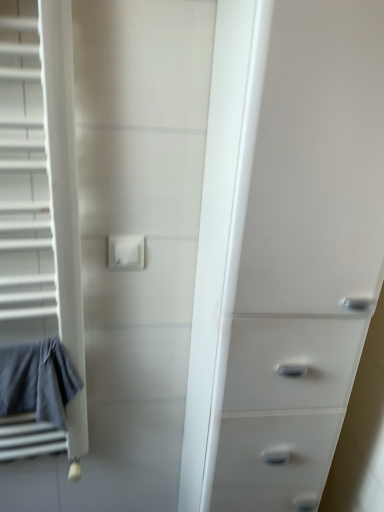
Question: Are white plastic chest of drawers at right and white plastic electric outlet at center located far from each other?

Choices:
 (A) yes
 (B) no

Answer: (B)

Question: Does white plastic chest of drawers at right appear on the left side of white plastic electric outlet at center?

Choices:
 (A) yes
 (B) no

Answer: (B)

Question: Considering the relative sizes of white plastic chest of drawers at right and white plastic electric outlet at center in the image provided, is white plastic chest of drawers at right taller than white plastic electric outlet at center?

Choices:
 (A) yes
 (B) no

Answer: (A)

Question: Does white plastic chest of drawers at right have a greater width compared to white plastic electric outlet at center?

Choices:
 (A) yes
 (B) no

Answer: (A)

Question: From the image's perspective, is white plastic chest of drawers at right below white plastic electric outlet at center?

Choices:
 (A) no
 (B) yes

Answer: (B)

Question: Would you say white plastic chest of drawers at right contains white plastic electric outlet at center?

Choices:
 (A) no
 (B) yes

Answer: (A)

Question: Does gray cotton bath towel at left appear on the right side of white plastic chest of drawers at right?

Choices:
 (A) no
 (B) yes

Answer: (A)

Question: Are gray cotton bath towel at left and white plastic chest of drawers at right beside each other?

Choices:
 (A) no
 (B) yes

Answer: (A)

Question: Is gray cotton bath towel at left bigger than white plastic chest of drawers at right?

Choices:
 (A) yes
 (B) no

Answer: (B)

Question: Considering the relative sizes of gray cotton bath towel at left and white plastic chest of drawers at right in the image provided, is gray cotton bath towel at left thinner than white plastic chest of drawers at right?

Choices:
 (A) no
 (B) yes

Answer: (B)

Question: Could you tell me if gray cotton bath towel at left is turned towards white plastic chest of drawers at right?

Choices:
 (A) no
 (B) yes

Answer: (A)

Question: Is gray cotton bath towel at left completely or partially outside of white plastic chest of drawers at right?

Choices:
 (A) no
 (B) yes

Answer: (B)

Question: From the image's perspective, is white plastic electric outlet at center above gray cotton bath towel at left?

Choices:
 (A) no
 (B) yes

Answer: (B)